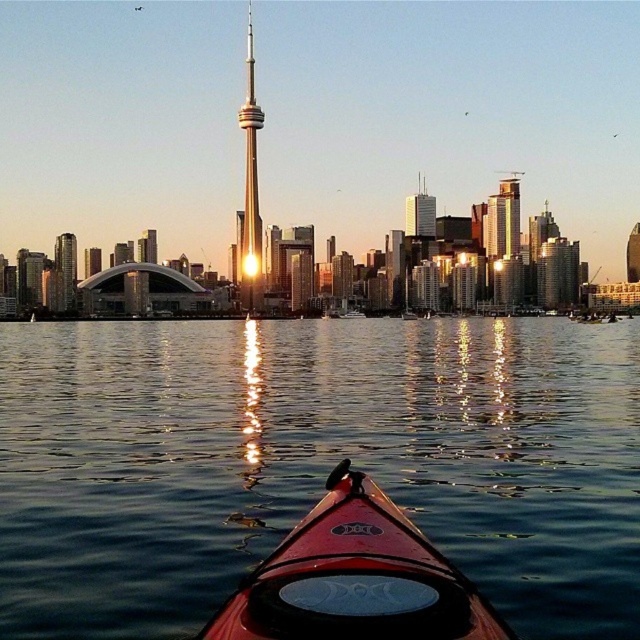
You are a photographer trying to capture the sunset reflection of the gold reflective tower at center in the water. Based on the scene description, where should you position yourself to ensure the tower is centered in your shot?

The gold reflective tower at center is located at point (250, 189), so positioning yourself directly in front of that coordinate will center the tower in your shot.

In the scene shown: You are a photographer positioned at point (314, 461) in the scene. What do you see directly in front of you?

You see glossy water at center directly in front of you at point (314, 461).

You are a photographer trying to capture the CN Tower reflection in the water. There is a matte red canoe at center and glossy water at center in your viewfinder. Which object should you move to ensure the CN Tower reflection is clearly visible?

You should move the matte red canoe at center because it is behind the glossy water at center and blocking the reflection.